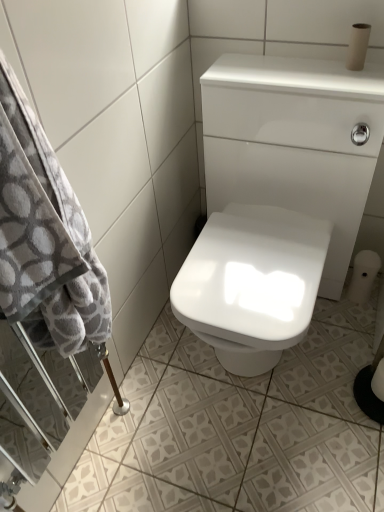
Question: Does white glossy sink at center have a larger size compared to matte brown toilet paper at upper right, the 3th toilet paper in the bottom-to-top sequence?

Choices:
 (A) yes
 (B) no

Answer: (A)

Question: From the image's perspective, is white glossy sink at center on matte brown toilet paper at upper right, positioned as the 3th toilet paper in back-to-front order?

Choices:
 (A) yes
 (B) no

Answer: (B)

Question: Is white glossy sink at center turned away from matte brown toilet paper at upper right, positioned as the 1th toilet paper in top-to-bottom order?

Choices:
 (A) yes
 (B) no

Answer: (B)

Question: Considering the relative positions of white glossy sink at center and matte brown toilet paper at upper right, positioned as the 1th toilet paper in top-to-bottom order, in the image provided, is white glossy sink at center to the left of matte brown toilet paper at upper right, positioned as the 1th toilet paper in top-to-bottom order, from the viewer's perspective?

Choices:
 (A) no
 (B) yes

Answer: (B)

Question: From a real-world perspective, is white glossy sink at center below matte brown toilet paper at upper right, positioned as the 1th toilet paper in top-to-bottom order?

Choices:
 (A) no
 (B) yes

Answer: (B)

Question: Can you confirm if white glossy sink at center is wider than matte brown toilet paper at upper right, positioned as the 1th toilet paper in top-to-bottom order?

Choices:
 (A) no
 (B) yes

Answer: (B)

Question: Considering the relative sizes of white matte toilet paper at lower right, which is counted as the 1th toilet paper, starting from the back, and white glossy sink at center in the image provided, is white matte toilet paper at lower right, which is counted as the 1th toilet paper, starting from the back, bigger than white glossy sink at center?

Choices:
 (A) no
 (B) yes

Answer: (A)

Question: Does white matte toilet paper at lower right, the 2th toilet paper ordered from the bottom, appear on the left side of white glossy sink at center?

Choices:
 (A) no
 (B) yes

Answer: (A)

Question: Considering the relative sizes of white matte toilet paper at lower right, positioned as the 2th toilet paper in top-to-bottom order, and white glossy sink at center in the image provided, is white matte toilet paper at lower right, positioned as the 2th toilet paper in top-to-bottom order, taller than white glossy sink at center?

Choices:
 (A) no
 (B) yes

Answer: (A)

Question: Is white matte toilet paper at lower right, which is counted as the 1th toilet paper, starting from the back, behind white glossy sink at center?

Choices:
 (A) yes
 (B) no

Answer: (A)

Question: Is white matte toilet paper at lower right, which is counted as the 1th toilet paper, starting from the back, far away from white glossy sink at center?

Choices:
 (A) no
 (B) yes

Answer: (A)

Question: Can you confirm if white matte toilet paper at lower right, positioned as the 2th toilet paper in top-to-bottom order, is shorter than white glossy sink at center?

Choices:
 (A) no
 (B) yes

Answer: (B)

Question: Considering the relative sizes of matte brown toilet paper at upper right, positioned as the 1th toilet paper in top-to-bottom order, and white glossy sink at center in the image provided, is matte brown toilet paper at upper right, positioned as the 1th toilet paper in top-to-bottom order, taller than white glossy sink at center?

Choices:
 (A) yes
 (B) no

Answer: (B)